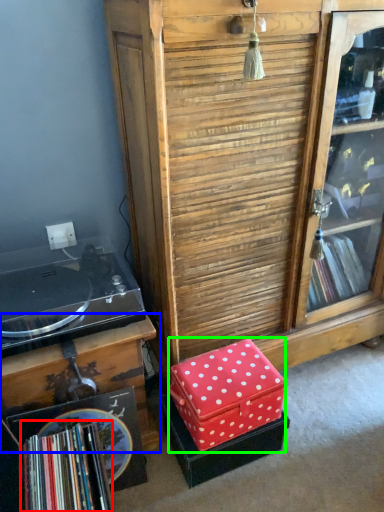
Question: Which is nearer to the book (highlighted by a red box)? table (highlighted by a blue box) or storage box (highlighted by a green box).

Choices:
 (A) table
 (B) storage box

Answer: (A)